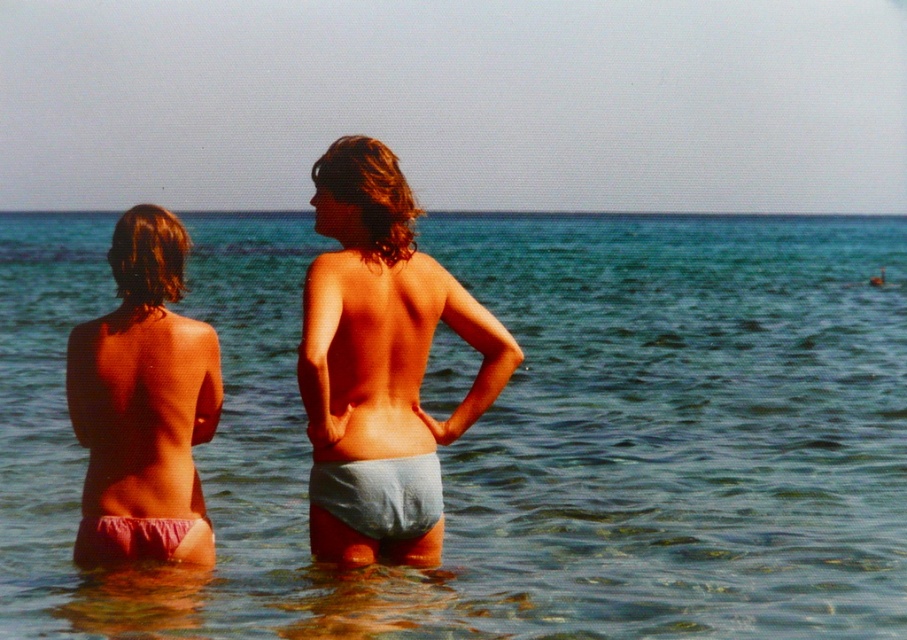
Question: Estimate the real-world distances between objects in this image. Which object is closer to the pink fabric bikini bottom at left?

Choices:
 (A) light blue fabric shorts at center
 (B) pink fabric bikini at lower left

Answer: (B)

Question: Which point is closer to the camera taking this photo?

Choices:
 (A) (166, 531)
 (B) (346, 200)
 (C) (679, 541)

Answer: (B)

Question: In this image, where is clear blue water at center located relative to light blue fabric shorts at center?

Choices:
 (A) right
 (B) left

Answer: (B)

Question: Observing the image, what is the correct spatial positioning of clear blue water at center in reference to light blue fabric shorts at center?

Choices:
 (A) left
 (B) right

Answer: (A)

Question: Does clear blue water at center lie behind pink fabric bikini at lower left?

Choices:
 (A) yes
 (B) no

Answer: (A)

Question: Which of the following is the closest to the observer?

Choices:
 (A) (169, 358)
 (B) (430, 260)
 (C) (174, 524)
 (D) (291, 260)

Answer: (A)